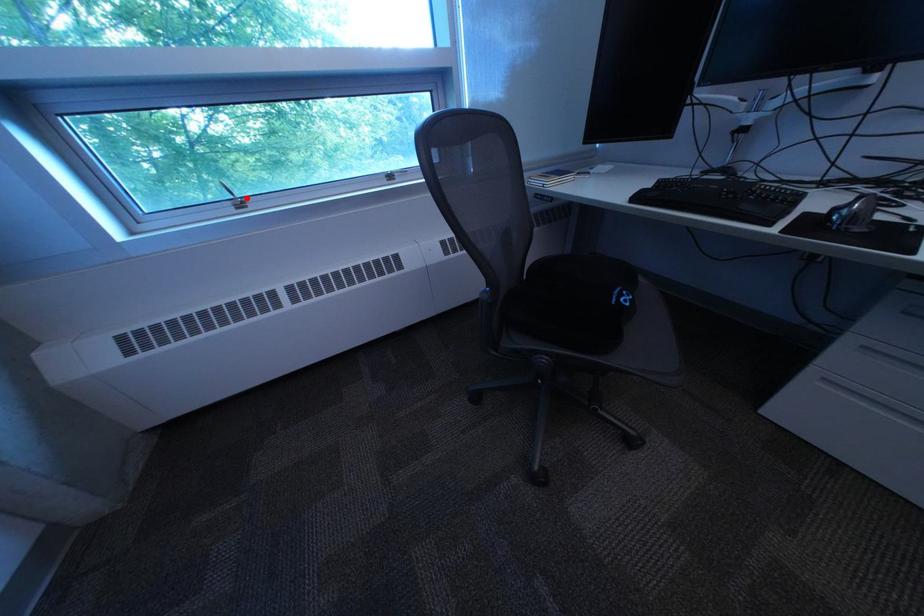
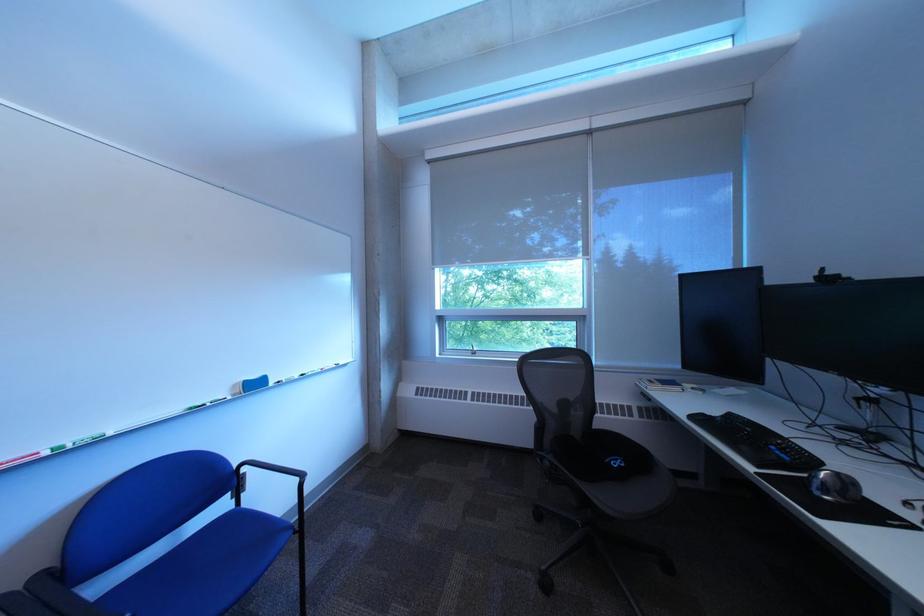
Question: I am providing you with two images of the same scene from different viewpoints. A red point is marked on the first image. Can you still see the location of the red point in image 2?

Choices:
 (A) Yes
 (B) No

Answer: (A)